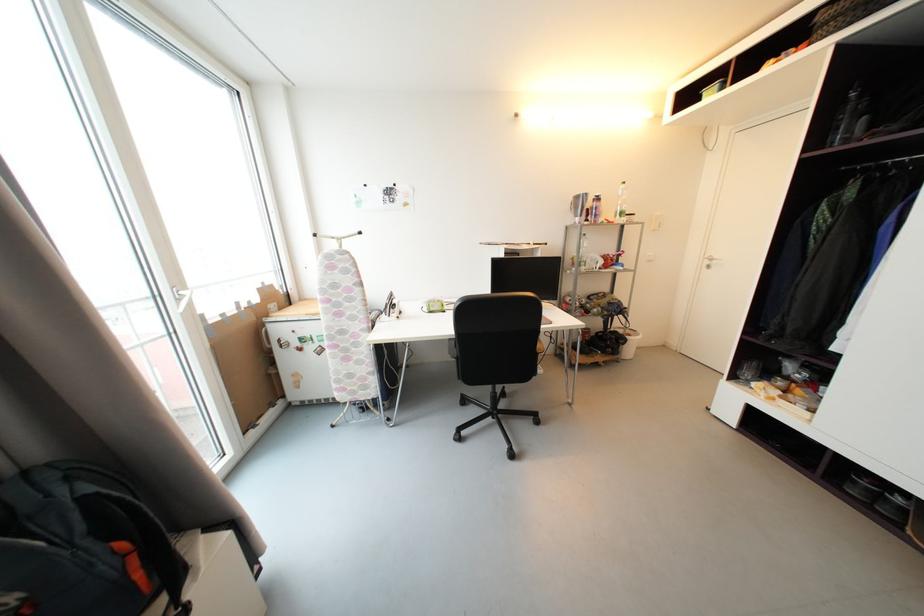
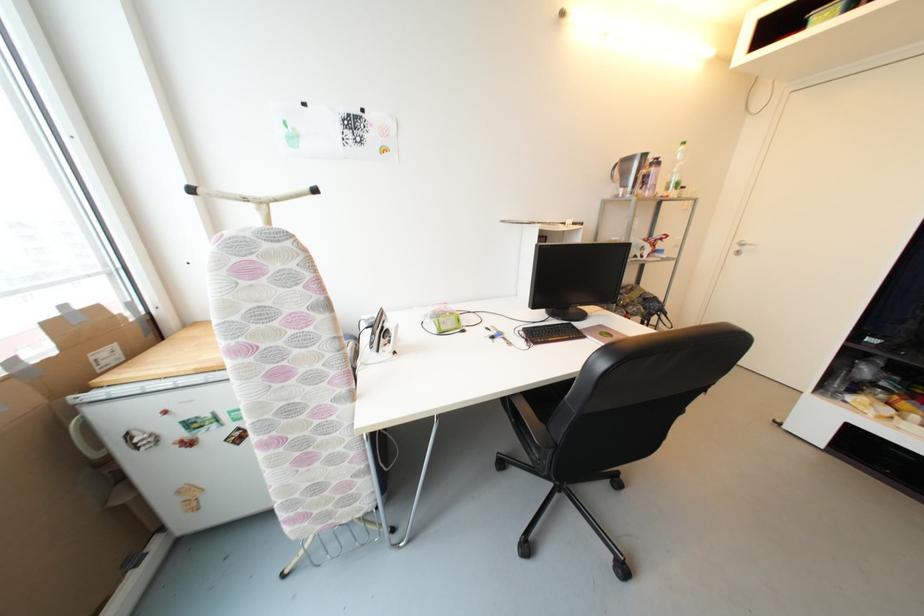
In a continuous first-person perspective shot, in which direction is the camera moving?

The cameraman walked toward left, forward.